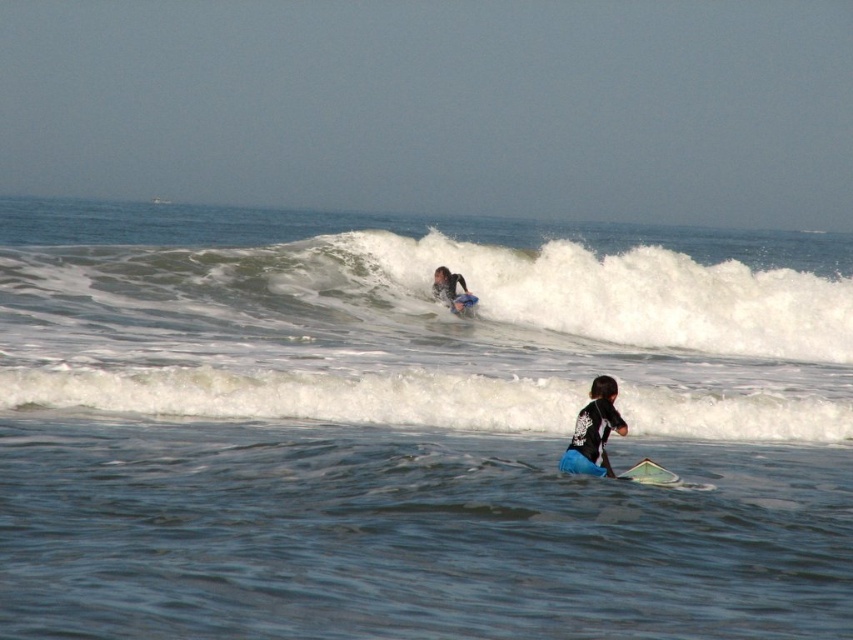
You are a beginner surfer trying to navigate between the white frothy wave at upper center and the blue rubber paddle at lower center. Since you want to avoid the paddle, which direction should you steer towards?

The white frothy wave at upper center is wider than the blue rubber paddle at lower center. To avoid the blue rubber paddle at lower center, steer towards the white frothy wave at upper center as it is wider and safer.

You are a photographer trying to capture a photo of both the dark blue wetsuit at upper center and the white foam surfboard at lower center in the same frame. Based on their positions, which object is positioned higher in the image?

The dark blue wetsuit at upper center is positioned higher in the image than the white foam surfboard at lower center.

You are a photographer trying to capture both the dark blue wetsuit at upper center and the white foam surfboard at lower center in one frame. Which object should you zoom in on to ensure both are clearly visible?

The dark blue wetsuit at upper center is larger in size than the white foam surfboard at lower center, so you should zoom in on the smaller object, the white foam surfboard at lower center, to ensure both are clearly visible in the frame.